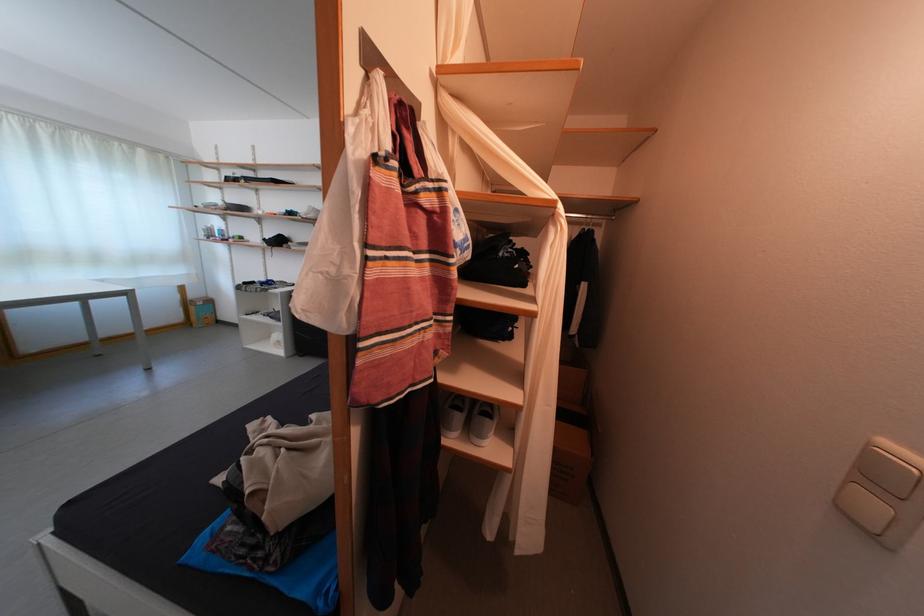
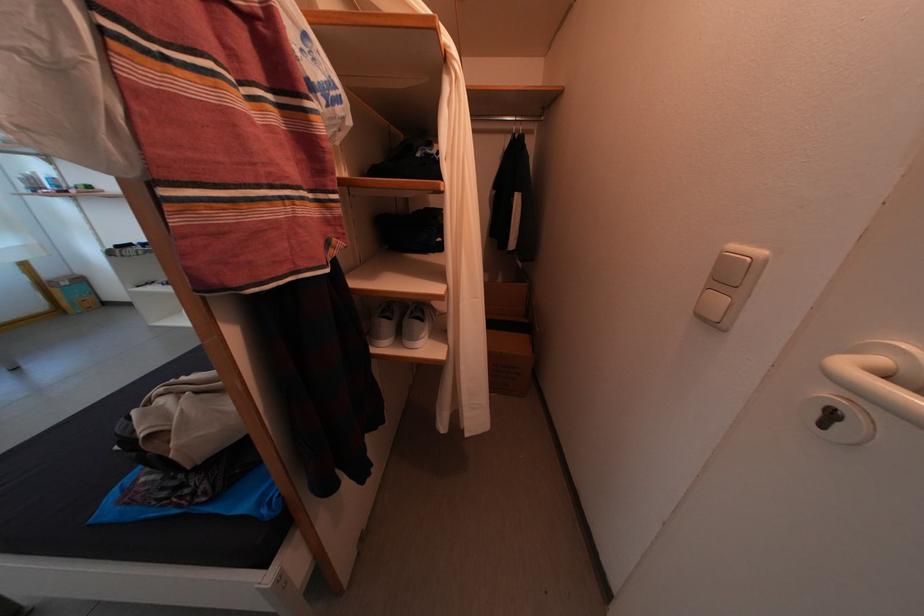
Where in the second image is the point corresponding to point 850,516 from the first image?

(709, 322)